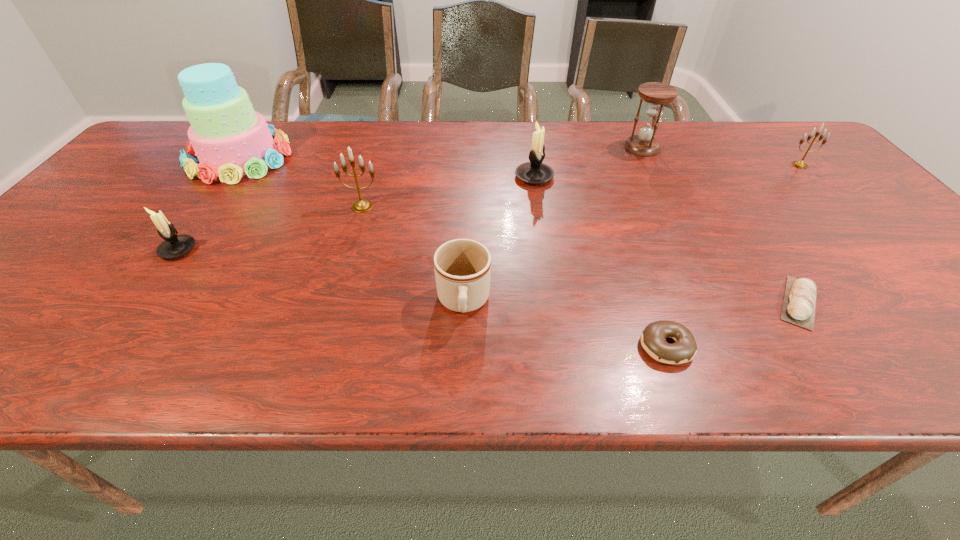
Locate which candelabrum is the third closest to the brown mug. Please provide its 2D coordinates. Your answer should be formatted as a tuple, i.e. [(x, y)], where the tuple contains the x and y coordinates of a point satisfying the conditions above.

[(173, 246)]

Locate an element on the screen. free location that satisfies the following two spatial constraints: 1. on the back side of the third object from right to left; 2. on the left side of the blue cake is located at coordinates (x=247, y=148).

Where is `free space that satisfies the following two spatial constraints: 1. on the front side of the blue cake; 2. on the left side of the fifth farthest object`? This screenshot has height=540, width=960. free space that satisfies the following two spatial constraints: 1. on the front side of the blue cake; 2. on the left side of the fifth farthest object is located at coordinates (205, 206).